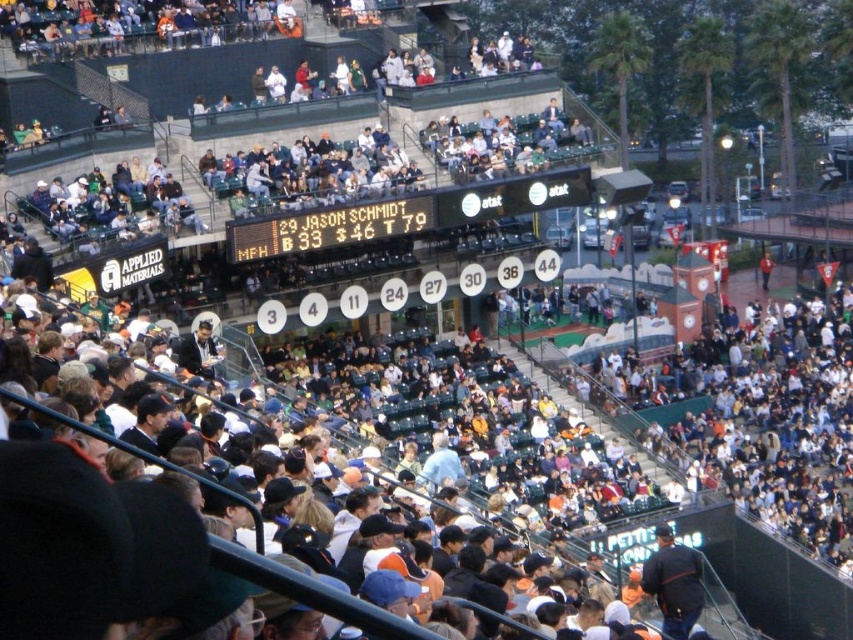
Question: Which of the following is the closest to the observer?

Choices:
 (A) black plastic scoreboard at upper center
 (B) black digital scoreboard at center

Answer: (B)

Question: Does black plastic scoreboard at upper center have a greater width compared to black digital scoreboard at center?

Choices:
 (A) yes
 (B) no

Answer: (A)

Question: Which of the following is the closest to the observer?

Choices:
 (A) black digital scoreboard at center
 (B) black plastic scoreboard at upper center

Answer: (A)

Question: Can you confirm if black plastic scoreboard at upper center is positioned to the right of black digital scoreboard at center?

Choices:
 (A) no
 (B) yes

Answer: (B)

Question: From the image, what is the correct spatial relationship of black plastic scoreboard at upper center in relation to black digital scoreboard at center?

Choices:
 (A) below
 (B) above

Answer: (B)